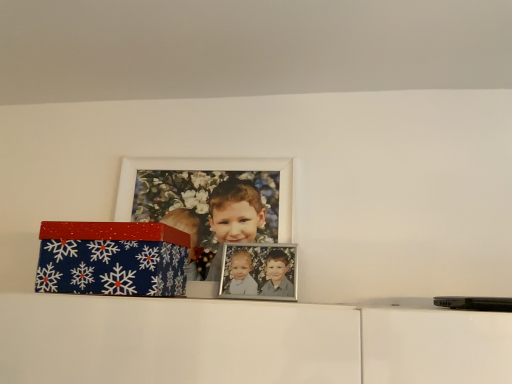
The width and height of the screenshot is (512, 384). What do you see at coordinates (112, 259) in the screenshot? I see `blue glittery box at left` at bounding box center [112, 259].

Locate an element on the screen. This screenshot has width=512, height=384. blue glittery box at left is located at coordinates (112, 259).

Where is `white matte picture frame at upper center`? white matte picture frame at upper center is located at coordinates pos(208,170).

Image resolution: width=512 pixels, height=384 pixels. Describe the element at coordinates (208, 170) in the screenshot. I see `white matte picture frame at upper center` at that location.

Identify the location of blue glittery box at left. (112, 259).

Is blue glittery box at left to the left or to the right of white matte picture frame at upper center in the image?

blue glittery box at left is to the left of white matte picture frame at upper center.

Which is behind, blue glittery box at left or white matte picture frame at upper center?

Positioned behind is white matte picture frame at upper center.

Is point (67, 289) more distant than point (206, 164)?

No, it is in front of (206, 164).

From the image's perspective, is blue glittery box at left on white matte picture frame at upper center?

No, from the image's perspective, blue glittery box at left is not over white matte picture frame at upper center.

Looking at this image, from a real-world perspective, does blue glittery box at left stand above white matte picture frame at upper center?

No, from a real-world perspective, blue glittery box at left is not over white matte picture frame at upper center

Which of these two, blue glittery box at left or white matte picture frame at upper center, is wider?

blue glittery box at left is wider.

Is blue glittery box at left taller or shorter than white matte picture frame at upper center?

blue glittery box at left is shorter than white matte picture frame at upper center.

Considering the sizes of objects blue glittery box at left and white matte picture frame at upper center in the image provided, who is smaller, blue glittery box at left or white matte picture frame at upper center?

Smaller between the two is white matte picture frame at upper center.

Is blue glittery box at left not within white matte picture frame at upper center?

Absolutely, blue glittery box at left is external to white matte picture frame at upper center.

Is blue glittery box at left directly adjacent to white matte picture frame at upper center?

blue glittery box at left and white matte picture frame at upper center are not in contact.

Is blue glittery box at left oriented towards white matte picture frame at upper center?

No, blue glittery box at left does not turn towards white matte picture frame at upper center.

What's the angular difference between blue glittery box at left and white matte picture frame at upper center's facing directions?

They differ by 0.00187 degrees in their facing directions.

Find the location of `picture frame above the blue glittery box at left (from a real-world perspective)`. picture frame above the blue glittery box at left (from a real-world perspective) is located at coordinates (208, 170).

Which is more to the left, white matte picture frame at upper center or blue glittery box at left?

blue glittery box at left.

Which object is more forward, white matte picture frame at upper center or blue glittery box at left?

Positioned in front is blue glittery box at left.

Which is behind, point (283, 197) or point (170, 233)?

Positioned behind is point (283, 197).

From the image's perspective, would you say white matte picture frame at upper center is positioned over blue glittery box at left?

Yes, from the image's perspective, white matte picture frame at upper center is on top of blue glittery box at left.

From a real-world perspective, which is physically above, white matte picture frame at upper center or blue glittery box at left?

white matte picture frame at upper center.

Which of these two, white matte picture frame at upper center or blue glittery box at left, is wider?

blue glittery box at left is wider.

Between white matte picture frame at upper center and blue glittery box at left, which one has more height?

With more height is white matte picture frame at upper center.

Considering the relative sizes of white matte picture frame at upper center and blue glittery box at left in the image provided, is white matte picture frame at upper center bigger than blue glittery box at left?

Actually, white matte picture frame at upper center might be smaller than blue glittery box at left.

Based on the photo, is white matte picture frame at upper center positioned beyond the bounds of blue glittery box at left?

white matte picture frame at upper center is positioned outside blue glittery box at left.

Looking at this image, are white matte picture frame at upper center and blue glittery box at left beside each other?

No, white matte picture frame at upper center is not touching blue glittery box at left.

Is white matte picture frame at upper center positioned with its back to blue glittery box at left?

Absolutely, white matte picture frame at upper center is directed away from blue glittery box at left.

How many degrees apart are the facing directions of white matte picture frame at upper center and blue glittery box at left?

There is a 0.00187-degree angle between the facing directions of white matte picture frame at upper center and blue glittery box at left.

Find the location of a particular element. The height and width of the screenshot is (384, 512). picture frame above the blue glittery box at left (from the image's perspective) is located at coordinates (208, 170).

Find the location of a particular element. picture frame on the right of blue glittery box at left is located at coordinates (208, 170).

Identify the location of box in front of the white matte picture frame at upper center. The height and width of the screenshot is (384, 512). (112, 259).